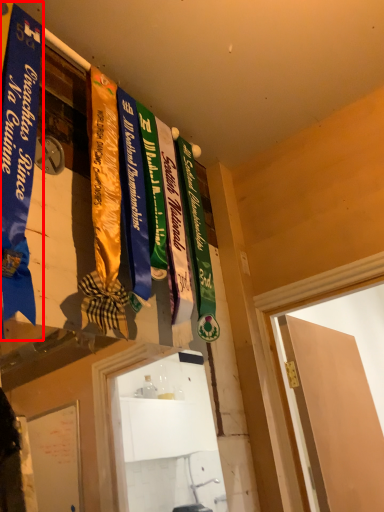
Question: In this image, where is banner (annotated by the red box) located relative to door?

Choices:
 (A) left
 (B) right

Answer: (A)